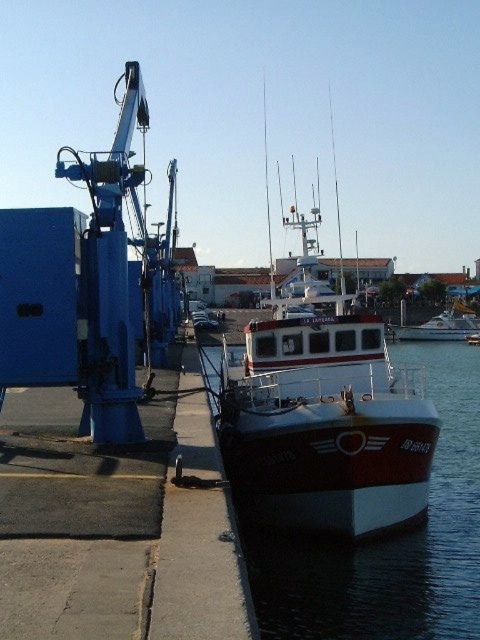
You are a photographer planning to capture the white glossy boat at center and the white glossy water at center in a single frame. Given that your camera has a fixed focal length, which object should you prioritize positioning closer to the center of the frame to ensure both are adequately captured without cropping?

The white glossy water at center has a larger width than the white glossy boat at center, so you should prioritize positioning the white glossy water at center closer to the center of the frame to ensure both are adequately captured without cropping.

You are a photographer standing at the dock in the harbor scene. You want to take a photo that includes both the large blue crane on the left and the small white fishing boat with red accents. You notice two points marked in the scene. One is at coordinates point (307, 627) and the other at point (408, 339). Which of these points is closer to you, the photographer?

Point (307, 627) is closer to the camera than point (408, 339).

Consider the image. You are a photographer planning to capture the white glossy water at center and the white glossy boat at center in a single shot. Given that your camera has a fixed focal length, which object should you focus on to ensure both are in frame without cropping?

Since the white glossy water at center is smaller than the white glossy boat at center, you should focus on the white glossy boat at center to ensure both objects fit within the frame.